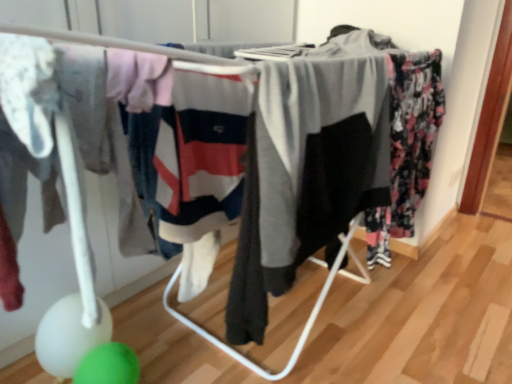
This screenshot has width=512, height=384. What are the coordinates of `vacant area on the back side of white glossy balloon at lower left` in the screenshot? It's located at (133, 316).